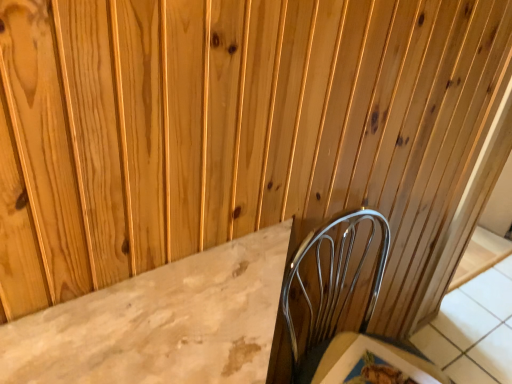
Question: Should I look upward or downward to see marble textured table at lower right?

Choices:
 (A) up
 (B) down

Answer: (B)